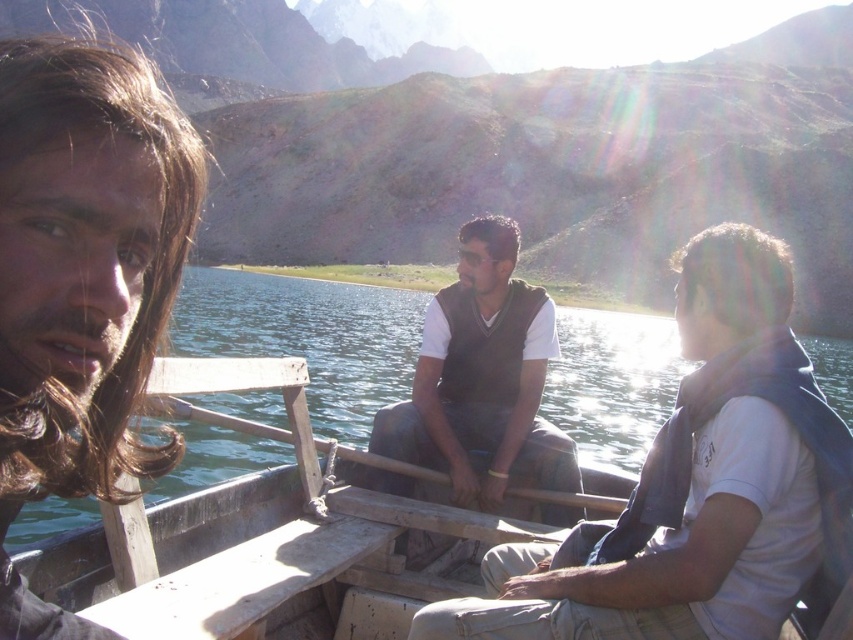
Question: Is brown fabric vest at center smaller than clear water at boat center?

Choices:
 (A) yes
 (B) no

Answer: (A)

Question: Which object is the closest to the brown suede vest at center?

Choices:
 (A) clear water at boat center
 (B) dark brown hair at left
 (C) brown fabric vest at center

Answer: (C)

Question: Which is nearer to the brown suede vest at center?

Choices:
 (A) brown fabric vest at center
 (B) dark brown hair at left
 (C) clear water at boat center

Answer: (A)

Question: Is dark brown hair at left above clear water at boat center?

Choices:
 (A) no
 (B) yes

Answer: (B)

Question: Is brown fabric vest at center positioned behind dark brown hair at left?

Choices:
 (A) no
 (B) yes

Answer: (B)

Question: Among these objects, which one is farthest from the camera?

Choices:
 (A) dark brown hair at left
 (B) brown fabric vest at center

Answer: (B)